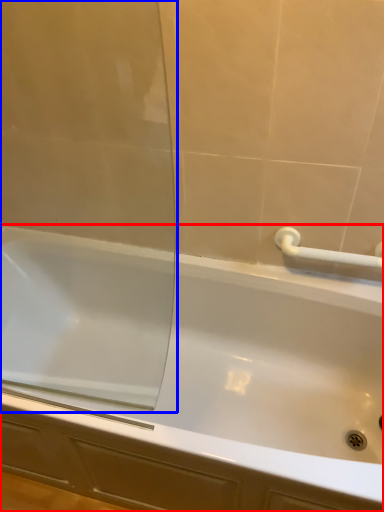
Question: Which object is closer to the camera taking this photo, bathtub (highlighted by a red box) or screen door (highlighted by a blue box)?

Choices:
 (A) bathtub
 (B) screen door

Answer: (B)